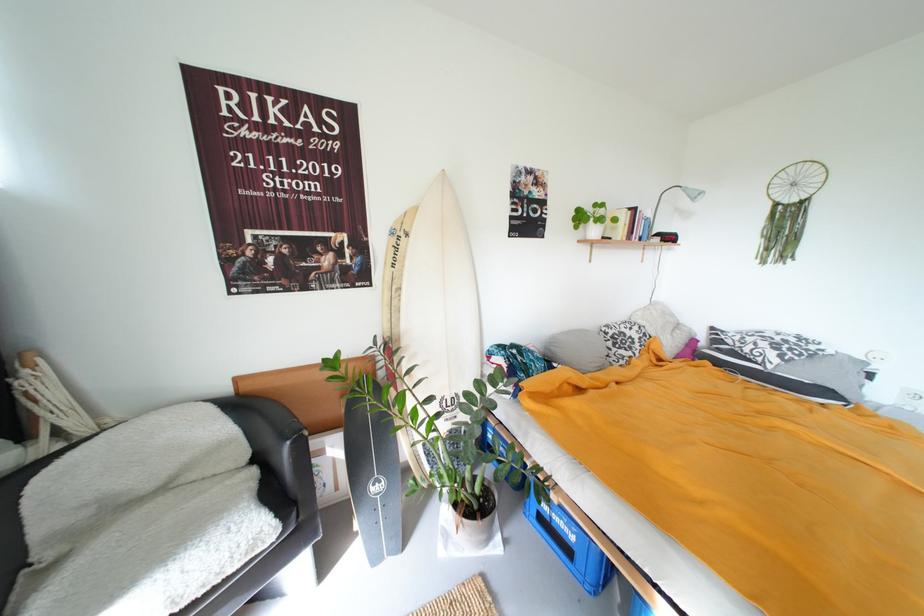
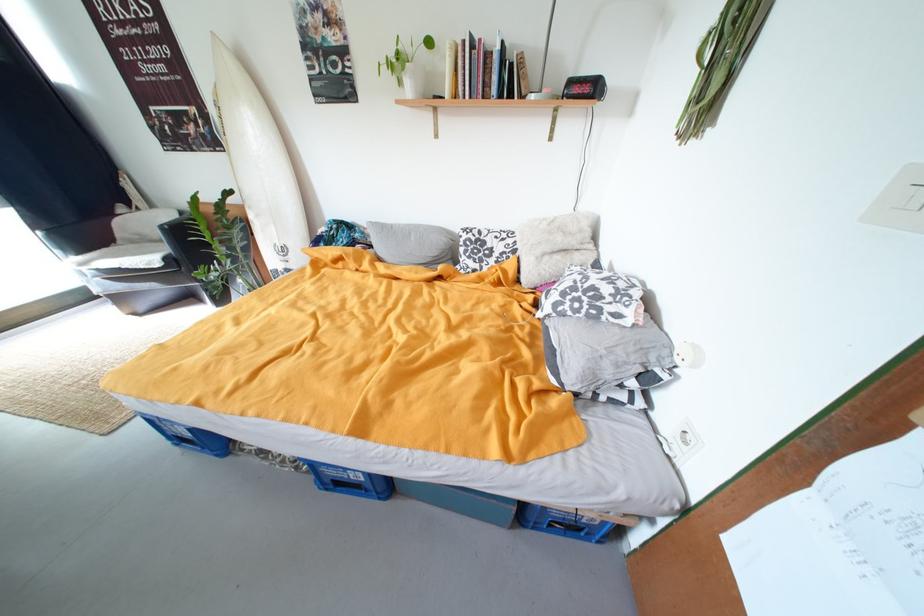
Locate, in the second image, the point that corresponds to (x=788, y=359) in the first image.

(564, 306)